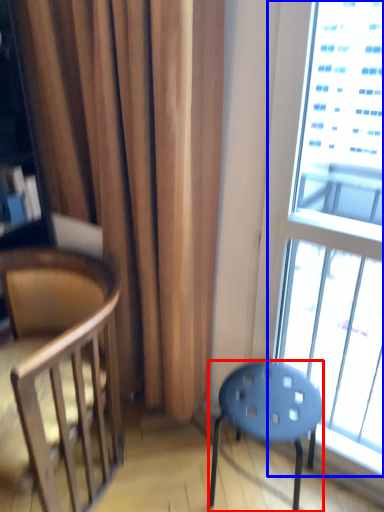
Question: Among these objects, which one is nearest to the camera, stool (highlighted by a red box) or window (highlighted by a blue box)?

Choices:
 (A) stool
 (B) window

Answer: (B)